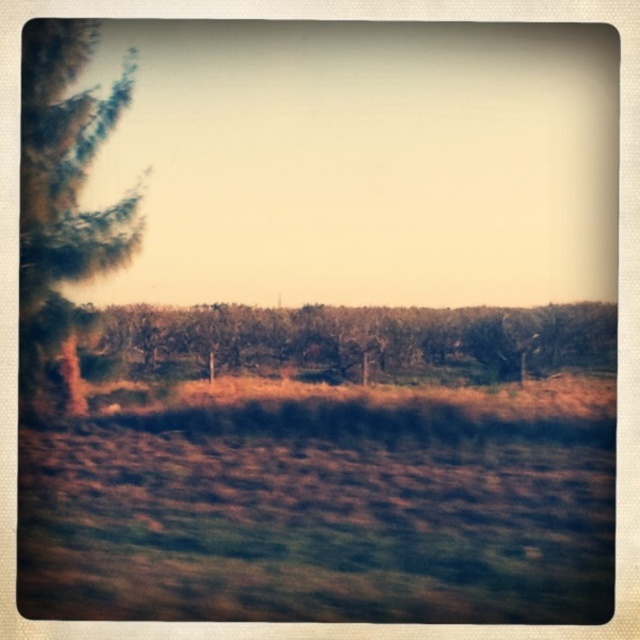
Question: Is brown grass at lower center below green textured tree at left?

Choices:
 (A) no
 (B) yes

Answer: (B)

Question: Which object is positioned farthest from the brown grass at lower center?

Choices:
 (A) green textured tree at left
 (B) brown textured trees at center

Answer: (A)

Question: Which of the following is the closest to the observer?

Choices:
 (A) brown grass at lower center
 (B) brown textured trees at center
 (C) green textured tree at left

Answer: (A)

Question: Estimate the real-world distances between objects in this image. Which object is closer to the brown textured trees at center?

Choices:
 (A) brown grass at lower center
 (B) green textured tree at left

Answer: (A)

Question: From the image, what is the correct spatial relationship of brown grass at lower center in relation to brown textured trees at center?

Choices:
 (A) right
 (B) left

Answer: (B)

Question: Can you confirm if brown textured trees at center is wider than green textured tree at left?

Choices:
 (A) yes
 (B) no

Answer: (A)